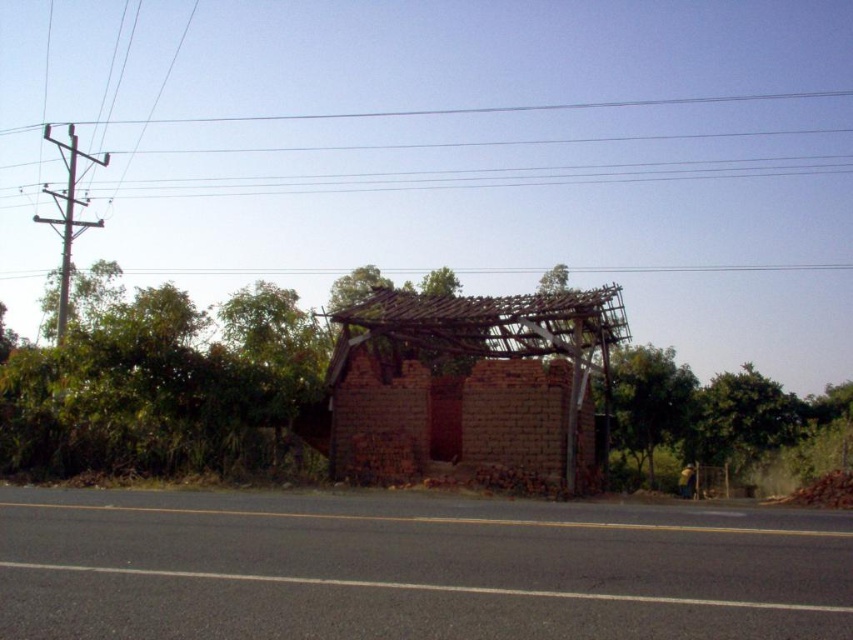
You are a pedestrian standing on the paved road and see the green leafy tree at center and the green leafy tree at right. Which tree is closer to the ground?

The green leafy tree at center is below green leafy tree at right, so it is closer to the ground.

You are standing at point (469, 388) in the rural scene. What object is located exactly at your current position?

The red brick hut at center is located exactly at point (469, 388).

You are a hiker standing on the paved road and want to take a photo of both the green leafy tree at center and the green leafy tree at right. Which tree should you position closer to in order to capture both trees in the frame without moving your camera?

The green leafy tree at center is taller than the green leafy tree at right, so you should position closer to the shorter green leafy tree at right to include both trees in the frame.